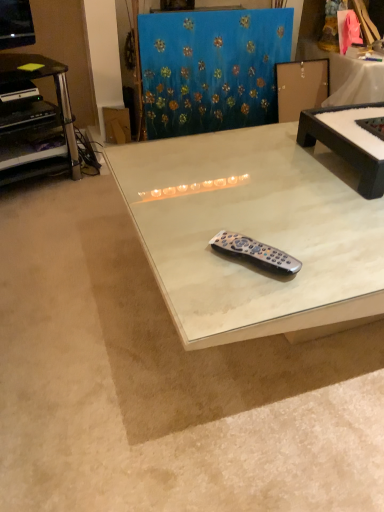
Where is `vacant space situated on the left part of black plastic remote at center`? vacant space situated on the left part of black plastic remote at center is located at coordinates (183, 260).